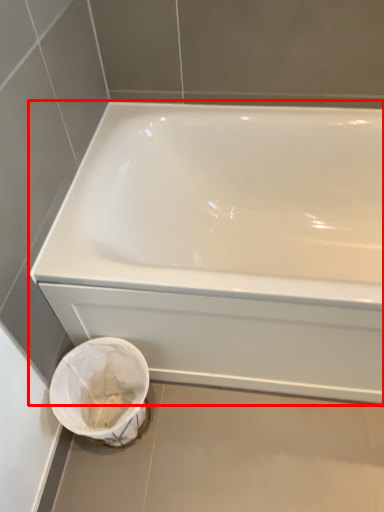
Question: From the image's perspective, what is the correct spatial positioning of bathtub (annotated by the red box) in reference to porcelain?

Choices:
 (A) above
 (B) below

Answer: (A)